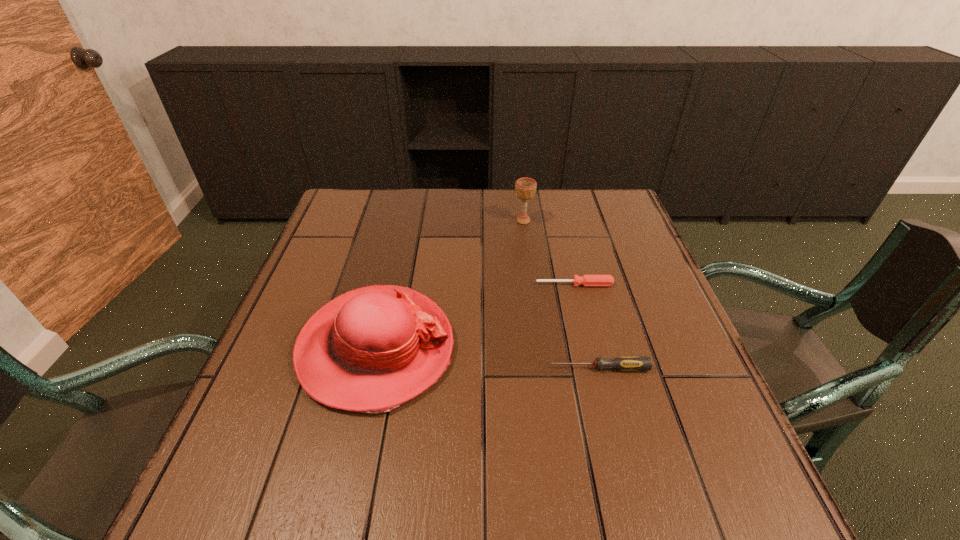
Locate an element on the screen. The image size is (960, 540). object at the far edge is located at coordinates (525, 188).

Locate an element on the screen. The height and width of the screenshot is (540, 960). object situated at the left edge is located at coordinates (372, 349).

Where is `vacant region at the far edge of the desktop`? This screenshot has width=960, height=540. vacant region at the far edge of the desktop is located at coordinates click(x=521, y=233).

In the image, there is a desktop. Where is `vacant area at the near edge`? The width and height of the screenshot is (960, 540). vacant area at the near edge is located at coordinates pos(460,505).

Where is `free region at the left edge of the desktop`? The image size is (960, 540). free region at the left edge of the desktop is located at coordinates (363, 269).

Identify the location of free region at the right edge of the desktop. The image size is (960, 540). (633, 271).

Identify the location of free space at the far left corner of the desktop. (377, 207).

I want to click on vacant space at the far right corner of the desktop, so click(623, 211).

Image resolution: width=960 pixels, height=540 pixels. In order to click on free spot between the farther screwdriver and the leftmost object in this screenshot , I will do click(475, 316).

Where is `unoccupied area between the nearer screwdriver and the chalice`? The width and height of the screenshot is (960, 540). unoccupied area between the nearer screwdriver and the chalice is located at coordinates (562, 294).